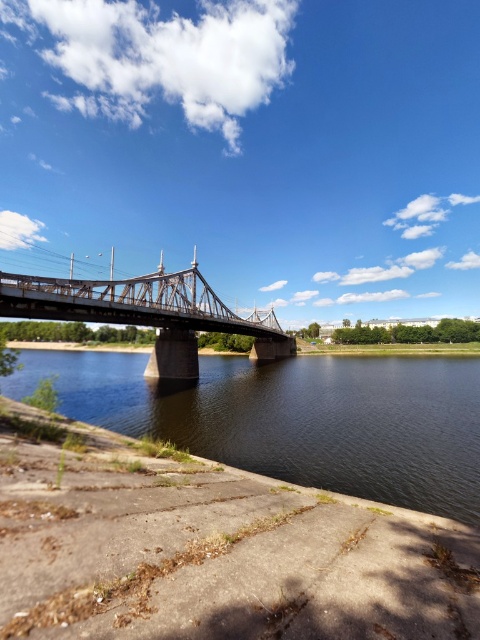
Based on the photo, does dark brown water at center have a greater height compared to metallic bridge at center?

In fact, dark brown water at center may be shorter than metallic bridge at center.

Does point (162, 429) come in front of point (253, 310)?

Yes, it is in front of point (253, 310).

Identify the location of dark brown water at center. (295, 419).